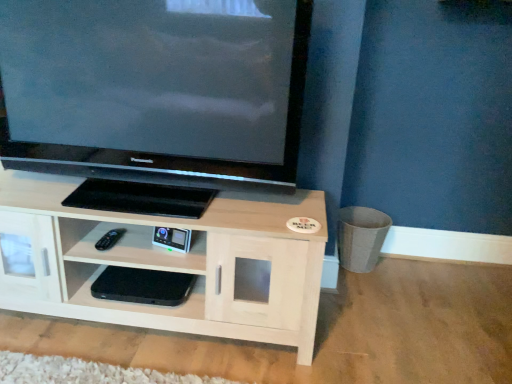
Question: Is black plastic remote at lower left looking in the opposite direction of black matte console at center, which ranks as the first shelf in bottom-to-top order?

Choices:
 (A) yes
 (B) no

Answer: (B)

Question: Is black plastic remote at lower left to the right of black matte console at center, which ranks as the first shelf in bottom-to-top order, from the viewer's perspective?

Choices:
 (A) yes
 (B) no

Answer: (B)

Question: Considering the relative positions of black plastic remote at lower left and black matte console at center, which ranks as the first shelf in bottom-to-top order, in the image provided, is black plastic remote at lower left to the left of black matte console at center, which ranks as the first shelf in bottom-to-top order, from the viewer's perspective?

Choices:
 (A) no
 (B) yes

Answer: (B)

Question: From a real-world perspective, is black plastic remote at lower left physically above black matte console at center, the 2th shelf positioned from the top?

Choices:
 (A) no
 (B) yes

Answer: (B)

Question: Is black plastic remote at lower left not inside black matte console at center, which ranks as the first shelf in bottom-to-top order?

Choices:
 (A) no
 (B) yes

Answer: (B)

Question: From a real-world perspective, is black matte console at center, which ranks as the first shelf in bottom-to-top order, above or below matte black television at upper left?

Choices:
 (A) above
 (B) below

Answer: (B)

Question: Is black matte console at center, which ranks as the first shelf in bottom-to-top order, to the left or to the right of matte black television at upper left in the image?

Choices:
 (A) left
 (B) right

Answer: (A)

Question: In the image, is black matte console at center, the 2th shelf positioned from the top, positioned in front of or behind matte black television at upper left?

Choices:
 (A) front
 (B) behind

Answer: (B)

Question: Is point (186, 314) closer or farther from the camera than point (105, 41)?

Choices:
 (A) closer
 (B) farther

Answer: (B)

Question: Is matte black television at upper left inside the boundaries of black plastic remote at lower left, or outside?

Choices:
 (A) inside
 (B) outside

Answer: (B)

Question: Considering the positions of matte black television at upper left and black plastic remote at lower left in the image, is matte black television at upper left bigger or smaller than black plastic remote at lower left?

Choices:
 (A) small
 (B) big

Answer: (B)

Question: Relative to black plastic remote at lower left, is matte black television at upper left in front or behind?

Choices:
 (A) behind
 (B) front

Answer: (B)

Question: In terms of width, does matte black television at upper left look wider or thinner when compared to black plastic remote at lower left?

Choices:
 (A) thin
 (B) wide

Answer: (B)

Question: In the image, is black plastic remote at lower left positioned in front of or behind matte black television at upper left?

Choices:
 (A) behind
 (B) front

Answer: (A)

Question: From a real-world perspective, is black plastic remote at lower left physically located above or below matte black television at upper left?

Choices:
 (A) above
 (B) below

Answer: (B)